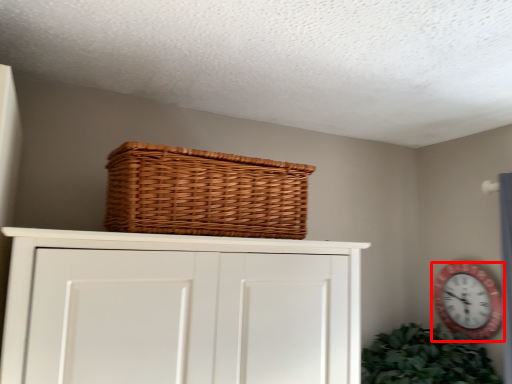
Question: In this image, where is wall clock (annotated by the red box) located relative to basket?

Choices:
 (A) left
 (B) right

Answer: (B)